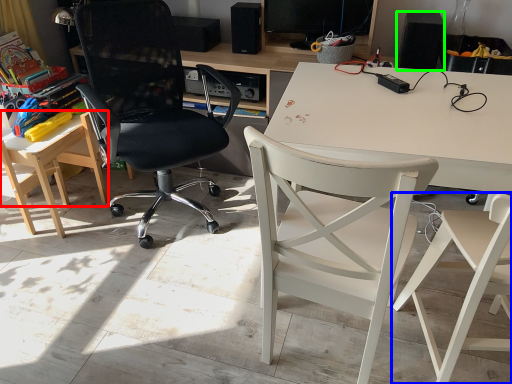
Question: Based on their relative distances, which object is farther from table (highlighted by a red box)? Choose from chair (highlighted by a blue box) and loudspeaker (highlighted by a green box).

Choices:
 (A) chair
 (B) loudspeaker

Answer: (A)